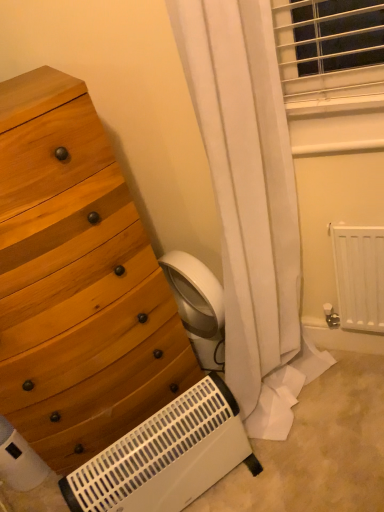
Question: Is point (54, 247) closer or farther from the camera than point (372, 249)?

Choices:
 (A) closer
 (B) farther

Answer: (A)

Question: From their relative heights in the image, would you say wooden chest of drawers at left is taller or shorter than white matte radiator at lower right?

Choices:
 (A) tall
 (B) short

Answer: (A)

Question: Which object is the farthest from the white matte radiator at lower right?

Choices:
 (A) white plastic heater at lower center
 (B) wooden chest of drawers at left

Answer: (B)

Question: Which object is positioned farthest from the white matte radiator at lower right?

Choices:
 (A) white plastic heater at lower center
 (B) wooden chest of drawers at left

Answer: (B)